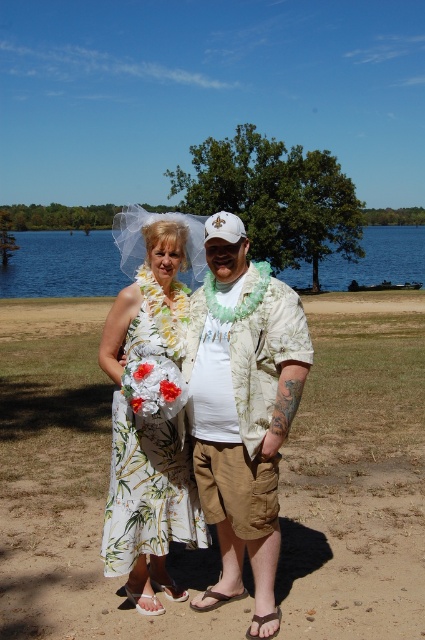
Between hawaiian print shirt at center and blue water at center, which one appears on the right side from the viewer's perspective?

blue water at center is more to the right.

What do you see at coordinates (243, 410) in the screenshot? I see `hawaiian print shirt at center` at bounding box center [243, 410].

The width and height of the screenshot is (425, 640). I want to click on hawaiian print shirt at center, so click(243, 410).

The image size is (425, 640). What are the coordinates of `hawaiian print shirt at center` in the screenshot? It's located at (243, 410).

Does white floral dress at center appear on the left side of blue water at center?

Yes, white floral dress at center is to the left of blue water at center.

Between white floral dress at center and blue water at center, which one has less height?

With less height is white floral dress at center.

Between point (178, 384) and point (308, 272), which one is positioned in front?

Positioned in front is point (178, 384).

The height and width of the screenshot is (640, 425). What are the coordinates of `white floral dress at center` in the screenshot? It's located at (150, 436).

Is hawaiian print shirt at center positioned in front of white floral dress at center?

No.

In the scene shown: Which is more to the left, hawaiian print shirt at center or white floral dress at center?

white floral dress at center is more to the left.

I want to click on hawaiian print shirt at center, so click(x=243, y=410).